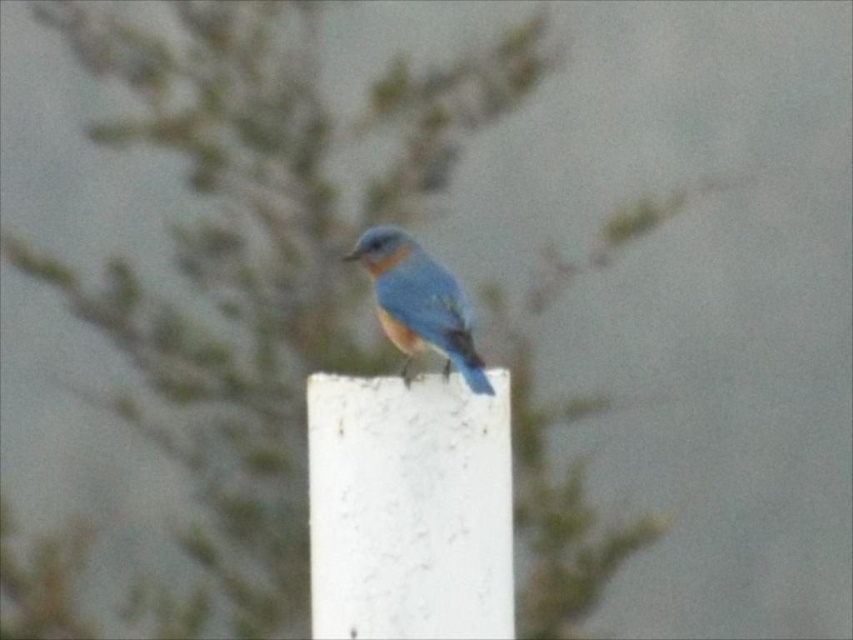
You are a photographer aiming to capture the blue glossy bird at center perched on the white textured pillar at center. Based on the scene description, where should you focus your camera to ensure both the bird and the pillar are in sharp focus?

You should focus your camera on the white textured pillar at center since it is positioned under the blue glossy bird at center, ensuring both are within the same focal plane.

You are a photographer aiming to capture the blue glossy bird at center and the white textured pillar at center in a single frame. Based on their positions, which object should you adjust your camera focus to first if you want to ensure both are in focus?

The white textured pillar at center is to the left of blue glossy bird at center, so you should focus on the white textured pillar at center first to ensure both are in focus.